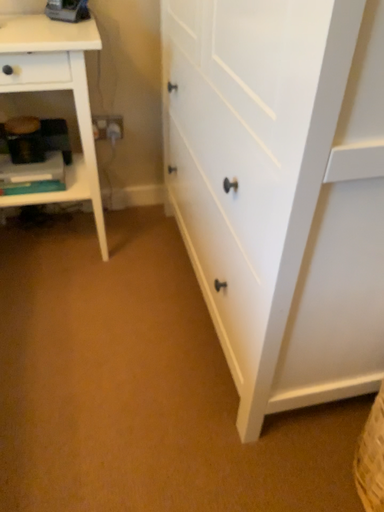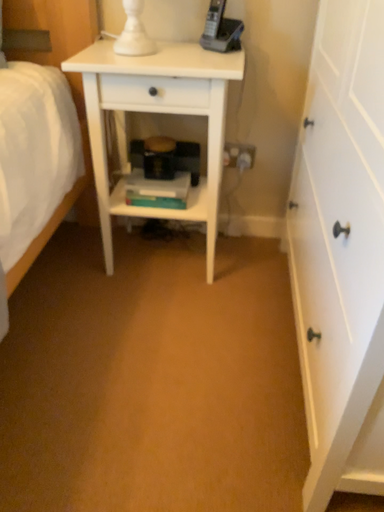
Question: How did the camera likely rotate when shooting the video?

Choices:
 (A) rotated right
 (B) rotated left

Answer: (B)